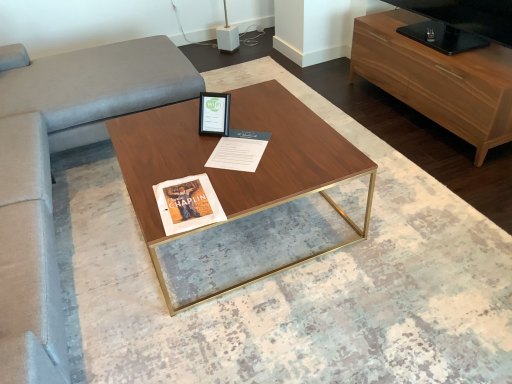
Question: Can you confirm if matte black picture frame at center is shorter than wooden cabinet at right?

Choices:
 (A) yes
 (B) no

Answer: (A)

Question: Considering the relative sizes of matte black picture frame at center and wooden cabinet at right in the image provided, is matte black picture frame at center taller than wooden cabinet at right?

Choices:
 (A) no
 (B) yes

Answer: (A)

Question: Can you confirm if matte black picture frame at center is wider than wooden cabinet at right?

Choices:
 (A) yes
 (B) no

Answer: (B)

Question: From the image's perspective, is matte black picture frame at center on wooden cabinet at right?

Choices:
 (A) no
 (B) yes

Answer: (A)

Question: Is matte black picture frame at center thinner than wooden cabinet at right?

Choices:
 (A) no
 (B) yes

Answer: (B)

Question: Is white paper at center inside the boundaries of walnut wood coffee table at center, or outside?

Choices:
 (A) inside
 (B) outside

Answer: (A)

Question: In the image, is white paper at center on the left side or the right side of walnut wood coffee table at center?

Choices:
 (A) right
 (B) left

Answer: (A)

Question: Considering the positions of white paper at center and walnut wood coffee table at center in the image, is white paper at center taller or shorter than walnut wood coffee table at center?

Choices:
 (A) short
 (B) tall

Answer: (A)

Question: Considering the positions of white paper at center and walnut wood coffee table at center in the image, is white paper at center wider or thinner than walnut wood coffee table at center?

Choices:
 (A) wide
 (B) thin

Answer: (B)

Question: Is point (268, 109) positioned closer to the camera than point (495, 140)?

Choices:
 (A) farther
 (B) closer

Answer: (B)

Question: Looking at the image, does walnut wood coffee table at center seem bigger or smaller compared to wooden cabinet at right?

Choices:
 (A) big
 (B) small

Answer: (A)

Question: In the image, is walnut wood coffee table at center positioned in front of or behind wooden cabinet at right?

Choices:
 (A) behind
 (B) front

Answer: (B)

Question: Is walnut wood coffee table at center wider or thinner than wooden cabinet at right?

Choices:
 (A) wide
 (B) thin

Answer: (A)

Question: Relative to velvet couch at left, is white paper at center in front or behind?

Choices:
 (A) front
 (B) behind

Answer: (A)

Question: Looking at their shapes, would you say white paper at center is wider or thinner than velvet couch at left?

Choices:
 (A) thin
 (B) wide

Answer: (A)